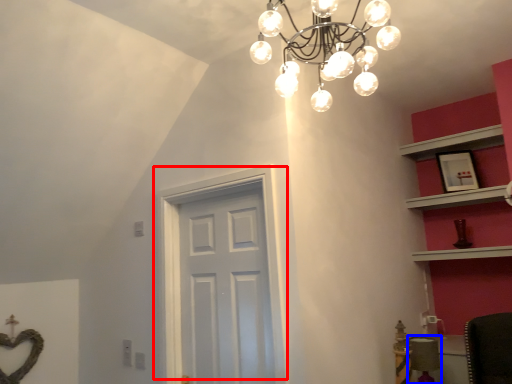
Question: Which object is closer to the camera taking this photo, door (highlighted by a red box) or chair (highlighted by a blue box)?

Choices:
 (A) door
 (B) chair

Answer: (A)